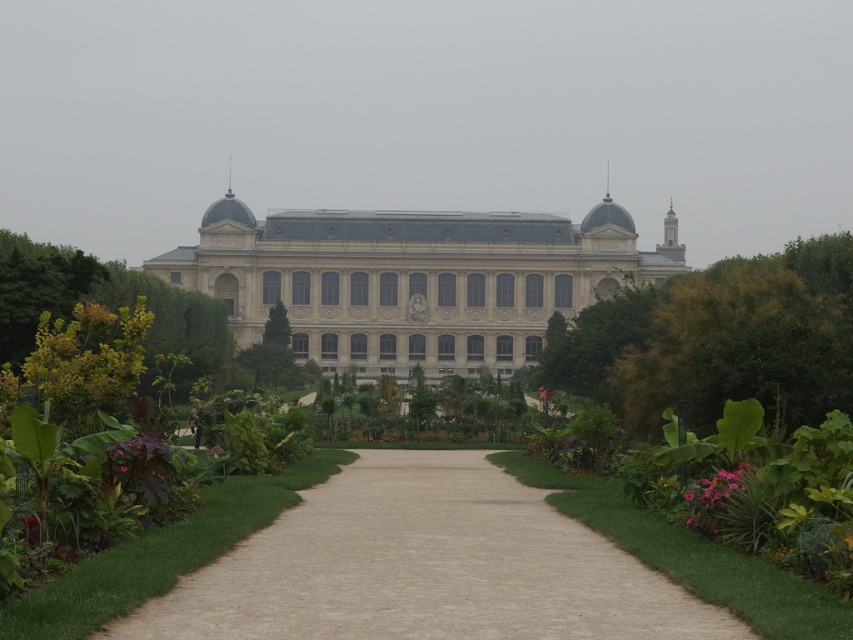
Looking at this image, is green leafy tree at center closer to the viewer compared to green leafy plant at center?

Yes, it is in front of green leafy plant at center.

Is point (608, 304) behind point (544, 394)?

Yes.

Locate an element on the screen. This screenshot has height=640, width=853. green leafy tree at center is located at coordinates (718, 339).

Is brown gravel path at center below green leafy tree at left?

Correct, brown gravel path at center is located below green leafy tree at left.

Looking at this image, which is more to the right, brown gravel path at center or green leafy tree at left?

From the viewer's perspective, brown gravel path at center appears more on the right side.

The image size is (853, 640). What are the coordinates of `brown gravel path at center` in the screenshot? It's located at (425, 566).

I want to click on pink matte flowers at lower right, so click(x=717, y=497).

Can you confirm if pink matte flowers at lower right is positioned to the left of green leafy plant at center?

In fact, pink matte flowers at lower right is to the right of green leafy plant at center.

Is point (720, 468) positioned before point (537, 392)?

Yes, it is.

Where is `pink matte flowers at lower right`? pink matte flowers at lower right is located at coordinates (717, 497).